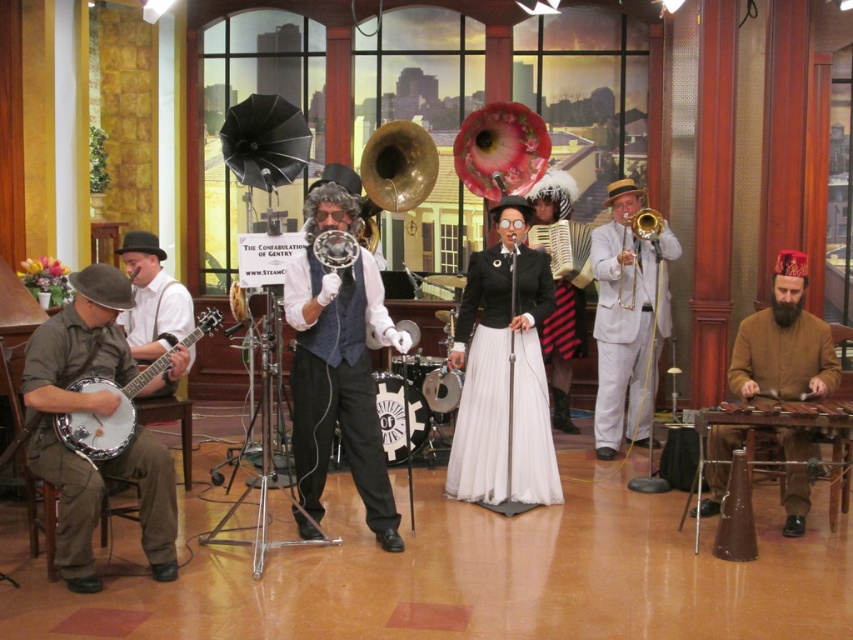
Which is in front, point (109, 456) or point (807, 406)?

Point (109, 456) is more forward.

Does matte brown banjo at left have a greater width compared to brown wooden xylophone at right?

In fact, matte brown banjo at left might be narrower than brown wooden xylophone at right.

The height and width of the screenshot is (640, 853). In order to click on matte brown banjo at left in this screenshot , I will do `click(119, 403)`.

You are a GUI agent. You are given a task and a screenshot of the screen. Output one action in this format:
    pyautogui.click(x=<x>, y=<y>)
    Task: Click on the brown fabric banjo at left
    The width and height of the screenshot is (853, 640).
    Given the screenshot: What is the action you would take?
    pyautogui.click(x=97, y=413)

Who is shorter, brown fabric banjo at left or brown woolen robe at lower right?

With less height is brown fabric banjo at left.

Who is more forward, (88, 570) or (717, 499)?

Point (88, 570) is more forward.

I want to click on brown fabric banjo at left, so click(97, 413).

Can you confirm if black satin dress at center is taller than brown woolen robe at lower right?

Indeed, black satin dress at center has a greater height compared to brown woolen robe at lower right.

Is black satin dress at center behind brown woolen robe at lower right?

That is True.

Locate an element on the screen. This screenshot has width=853, height=640. black satin dress at center is located at coordinates (503, 381).